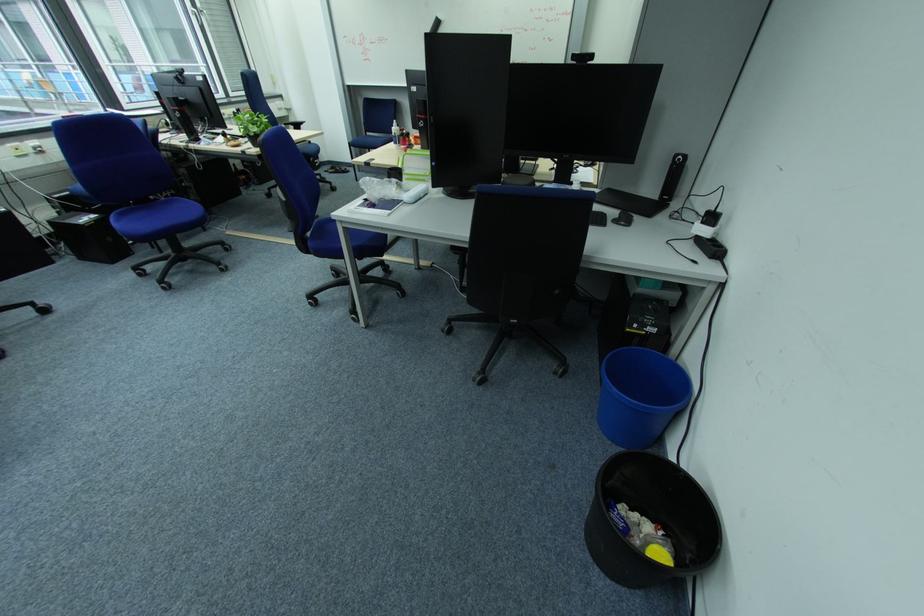
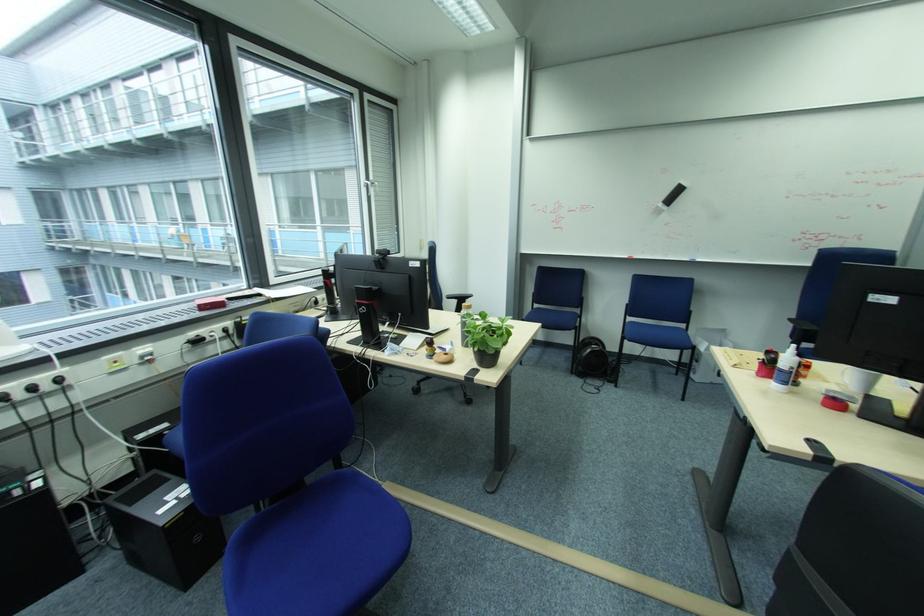
Where in the second image is the point corresponding to point (266, 124) from the first image?

(508, 333)